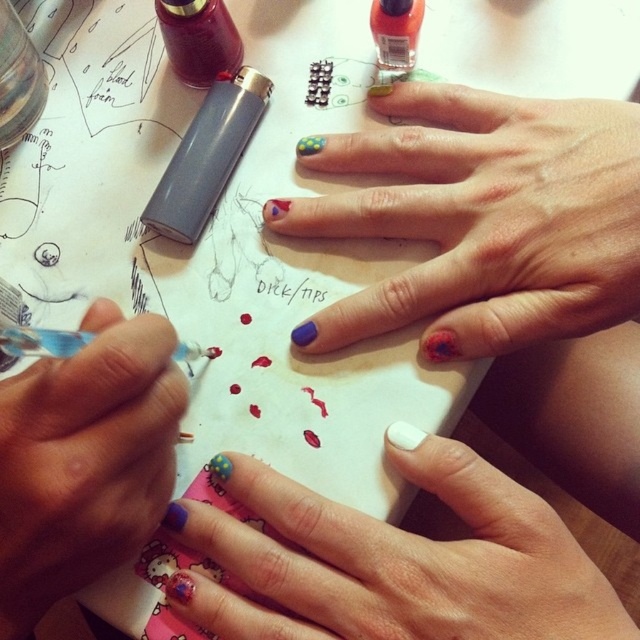
Can you confirm if multicolored painted nails at center is positioned to the right of blue matte nail polish at center?

Correct, you'll find multicolored painted nails at center to the right of blue matte nail polish at center.

Can you confirm if multicolored painted nails at center is positioned above blue matte nail polish at center?

Yes, multicolored painted nails at center is above blue matte nail polish at center.

Between point (465, 228) and point (44, 481), which one is positioned in front?

Point (44, 481)

Identify the location of multicolored painted nails at center. (483, 220).

Locate an element on the screen. blue matte nail polish at center is located at coordinates (84, 460).

Can you confirm if blue matte nail polish at center is positioned below neon orange glass nail polish at upper center?

Yes.

Image resolution: width=640 pixels, height=640 pixels. I want to click on blue matte nail polish at center, so click(84, 460).

At what (x,y) coordinates should I click in order to perform the action: click on blue matte nail polish at center. Please return your answer as a coordinate pair (x, y). This screenshot has width=640, height=640. Looking at the image, I should click on (84, 460).

Measure the distance between matte blue nail polish at center and neon orange glass nail polish at upper center.

The distance of matte blue nail polish at center from neon orange glass nail polish at upper center is 28.53 centimeters.

Based on the photo, who is more forward, (428,483) or (384,13)?

Point (428,483)

You are a GUI agent. You are given a task and a screenshot of the screen. Output one action in this format:
    pyautogui.click(x=<x>, y=<y>)
    Task: Click on the matte blue nail polish at center
    
    Given the screenshot: What is the action you would take?
    pyautogui.click(x=394, y=560)